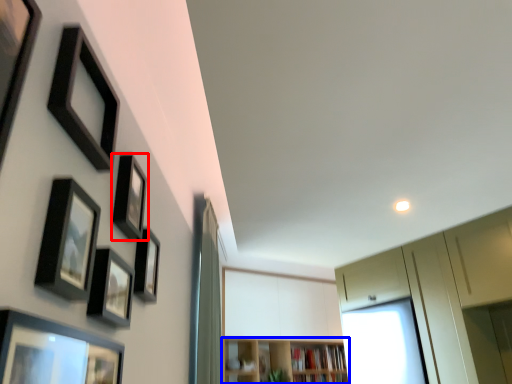
Question: Which object appears closest to the camera in this image, picture frame (highlighted by a red box) or shelf (highlighted by a blue box)?

Choices:
 (A) picture frame
 (B) shelf

Answer: (A)